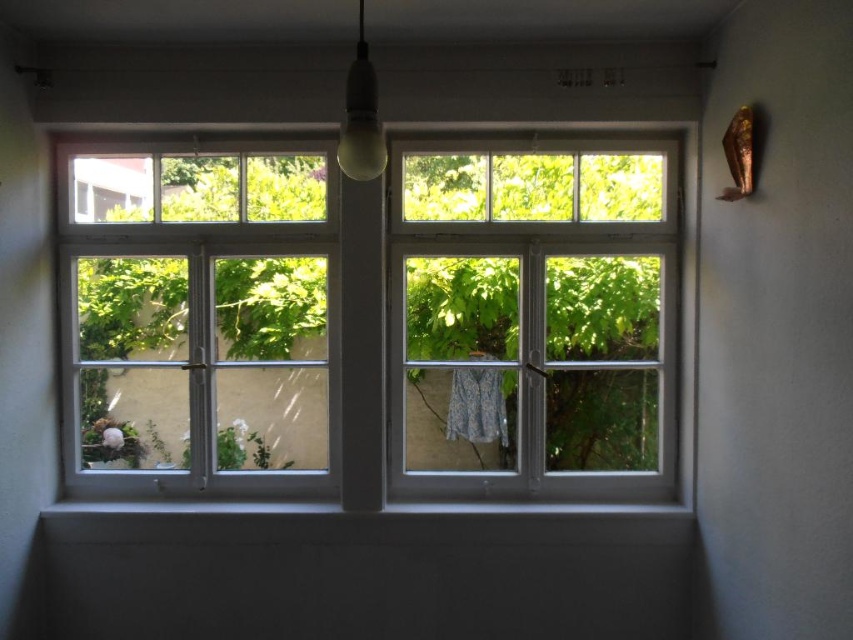
Measure the distance between point (x=213, y=394) and camera.

Point (x=213, y=394) and camera are 3.01 meters apart.

Who is more distant from viewer, (96, 237) or (383, 166)?

The point (96, 237) is more distant.

Does point (273, 262) come closer to viewer compared to point (370, 113)?

That is False.

Identify the location of white glass window at left. (196, 317).

Can you confirm if matte glass bulb at upper center is positioned to the left of patterned fabric curtain at center?

Yes, matte glass bulb at upper center is to the left of patterned fabric curtain at center.

Between matte glass bulb at upper center and patterned fabric curtain at center, which one appears on the right side from the viewer's perspective?

patterned fabric curtain at center

Does point (360, 166) lie behind point (502, 412)?

No, (360, 166) is in front of (502, 412).

Image resolution: width=853 pixels, height=640 pixels. What are the coordinates of `matte glass bulb at upper center` in the screenshot? It's located at (361, 116).

Does clear glass window at center appear on the right side of matte glass bulb at upper center?

Indeed, clear glass window at center is positioned on the right side of matte glass bulb at upper center.

Is the position of clear glass window at center less distant than that of matte glass bulb at upper center?

No.

Who is more forward, [482,486] or [364,177]?

Point [364,177] is in front.

You are a GUI agent. You are given a task and a screenshot of the screen. Output one action in this format:
    pyautogui.click(x=<x>, y=<y>)
    Task: Click on the clear glass window at center
    The width and height of the screenshot is (853, 640).
    Given the screenshot: What is the action you would take?
    pyautogui.click(x=532, y=317)